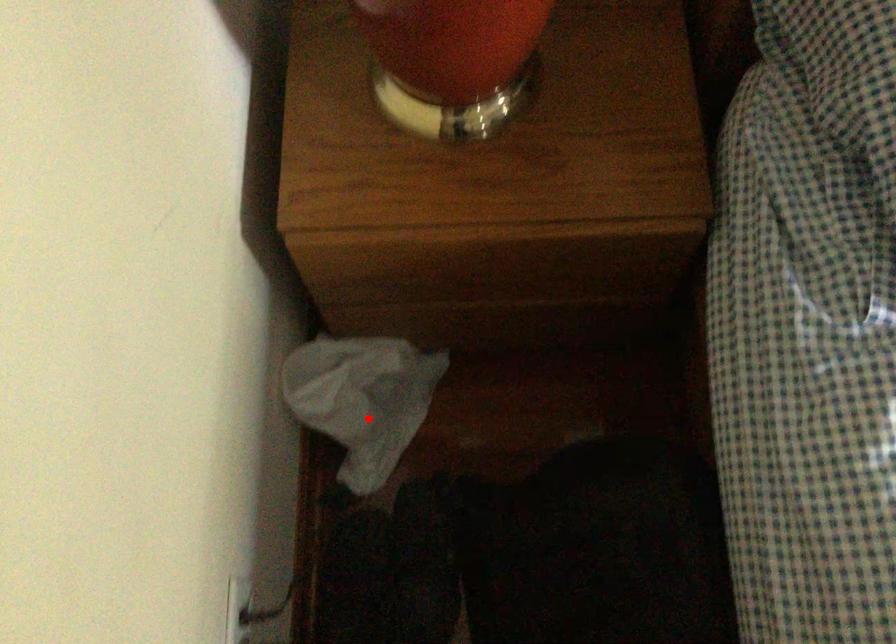
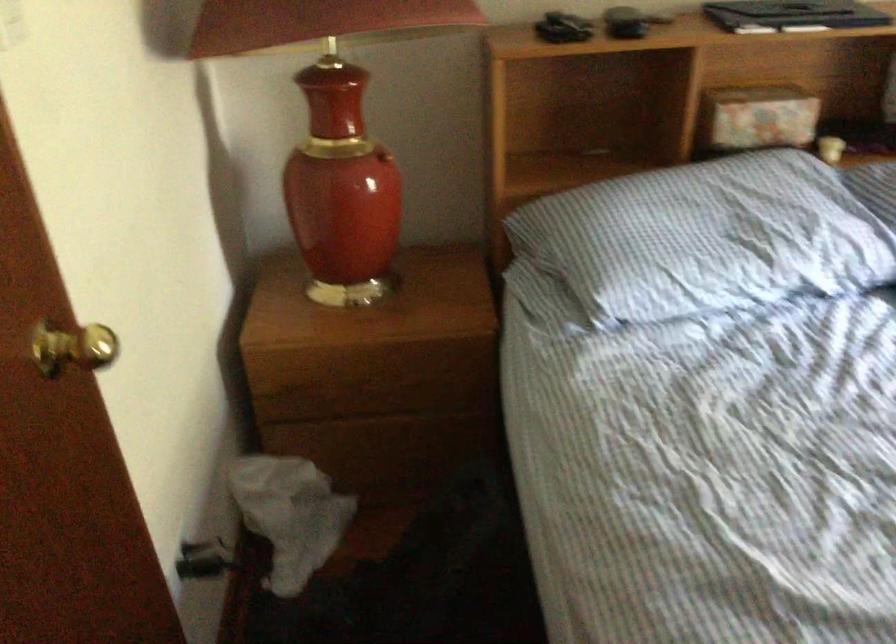
Question: I am providing you with two images of the same scene from different viewpoints. In image1, a red point is highlighted. Considering the same 3D point in image2, which of the following is correct?

Choices:
 (A) It is closer
 (B) It is farther

Answer: (B)